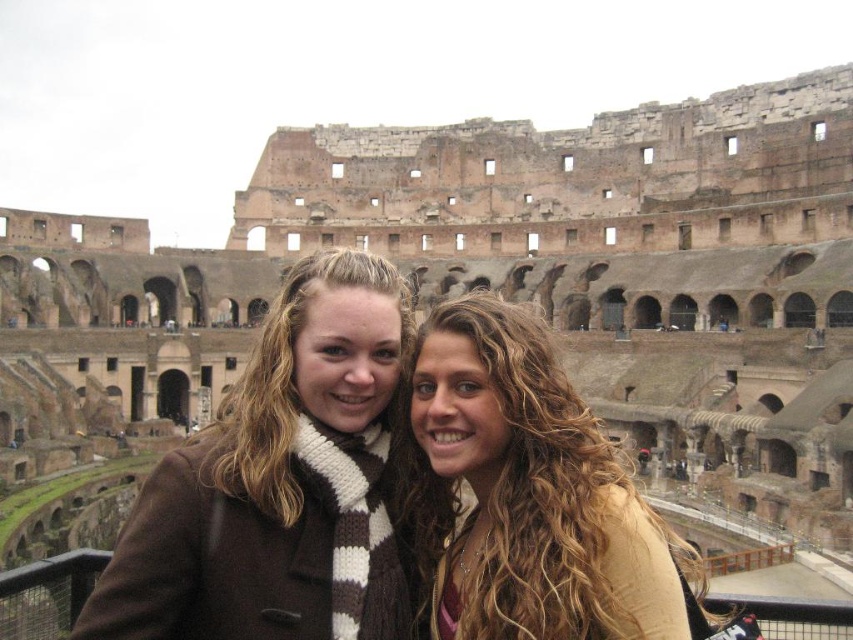
You are a photographer trying to capture a portrait of the two people in front of the Colosseum. You notice the brown woolen scarf at center and the curly hair at center. Which object is positioned higher on the person?

The brown woolen scarf at center is located above curly hair at center, so it is positioned higher on the person.

You are a photographer trying to capture the two people in front of the Colosseum. The curly hair at center is at point 0.769, 0.617. Where should you position your camera to ensure both individuals are in frame?

The curly hair at center is located at point (x=525, y=492), so positioning the camera to focus on that central area will ensure both individuals are captured in the frame.

You are a photographer planning to take a photo of the two people at the Colosseum. You want to ensure that both points, point (332, 349) and point (274, 483), are visible in the frame. Based on their positions, which point is closer to the camera?

Point (274, 483) is closer to the camera since point (332, 349) is positioned behind it.